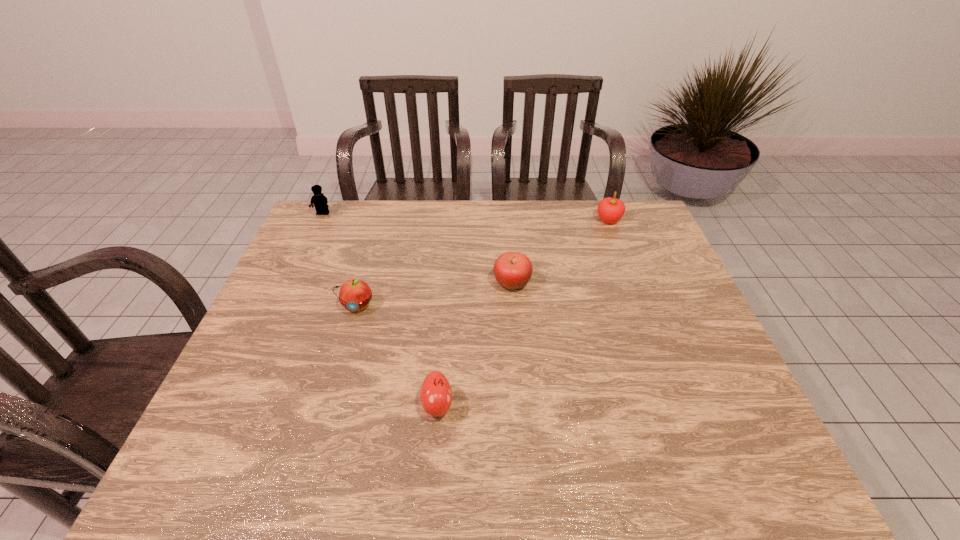
Image resolution: width=960 pixels, height=540 pixels. I want to click on the leftmost object, so click(x=320, y=202).

This screenshot has height=540, width=960. Identify the location of the farthest apple. (610, 210).

This screenshot has width=960, height=540. What are the coordinates of `the rightmost object` in the screenshot? It's located at (610, 210).

The width and height of the screenshot is (960, 540). In order to click on the second object from right to left in this screenshot , I will do `click(512, 270)`.

I want to click on the leftmost apple, so click(x=355, y=294).

Locate an element on the screen. the nearest object is located at coordinates (436, 394).

This screenshot has height=540, width=960. Identify the location of the second apple from left to right. coord(436,394).

You are a GUI agent. You are given a task and a screenshot of the screen. Output one action in this format:
    pyautogui.click(x=<x>, y=<y>)
    Task: Click on the vacant area situated 0.400m on the front-facing side of the Lego
    The width and height of the screenshot is (960, 540).
    Given the screenshot: What is the action you would take?
    pyautogui.click(x=282, y=299)

Where is `vacant region located 0.240m on the left of the farthest apple`? The width and height of the screenshot is (960, 540). vacant region located 0.240m on the left of the farthest apple is located at coordinates (525, 220).

At what (x,y) coordinates should I click in order to perform the action: click on free point located 0.370m on the right of the third apple from left to right. Please return your answer as a coordinate pair (x, y). The height and width of the screenshot is (540, 960). Looking at the image, I should click on [660, 283].